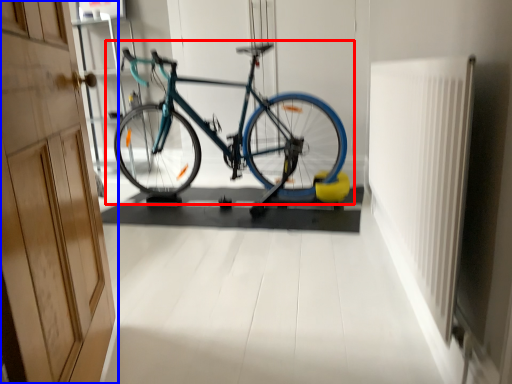
Question: Which object is further to the camera taking this photo, bicycle (highlighted by a red box) or door (highlighted by a blue box)?

Choices:
 (A) bicycle
 (B) door

Answer: (A)